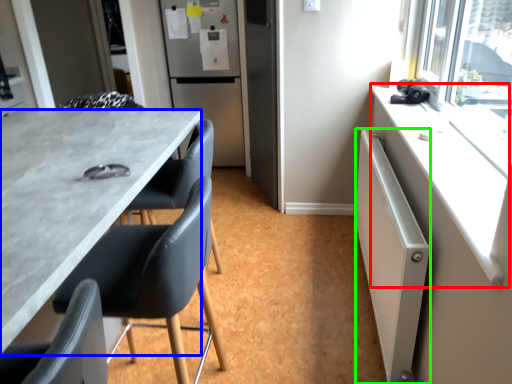
Question: Which object is positioned farthest from counter top (highlighted by a red box)? Select from desk (highlighted by a blue box) and radiator (highlighted by a green box).

Choices:
 (A) desk
 (B) radiator

Answer: (A)